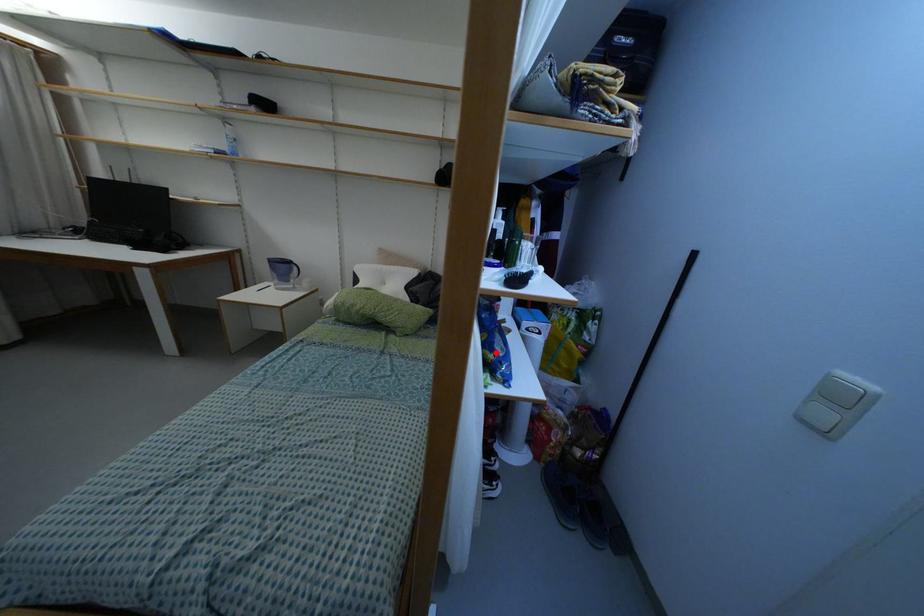
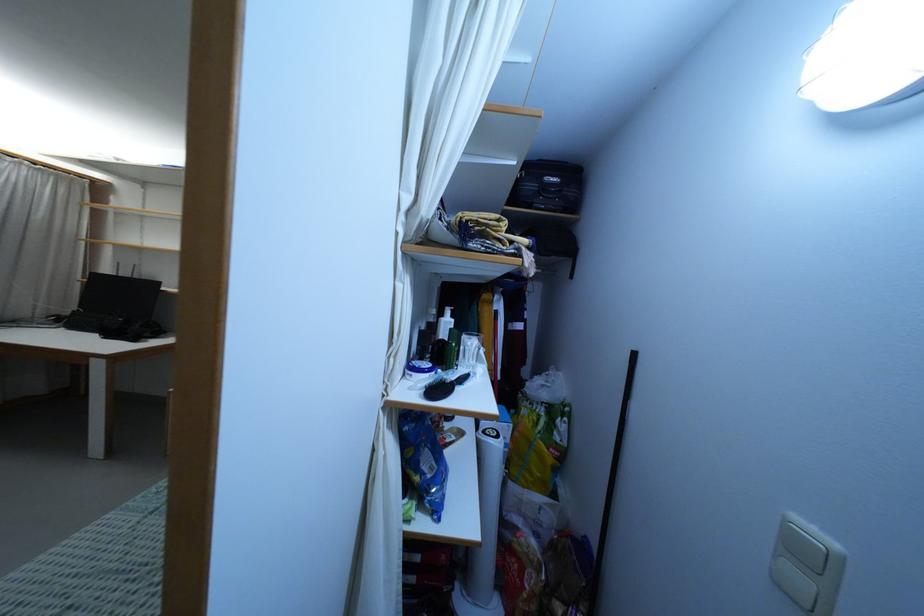
Find the pixel in the second image that matches the highlighted location in the first image.

(422, 474)